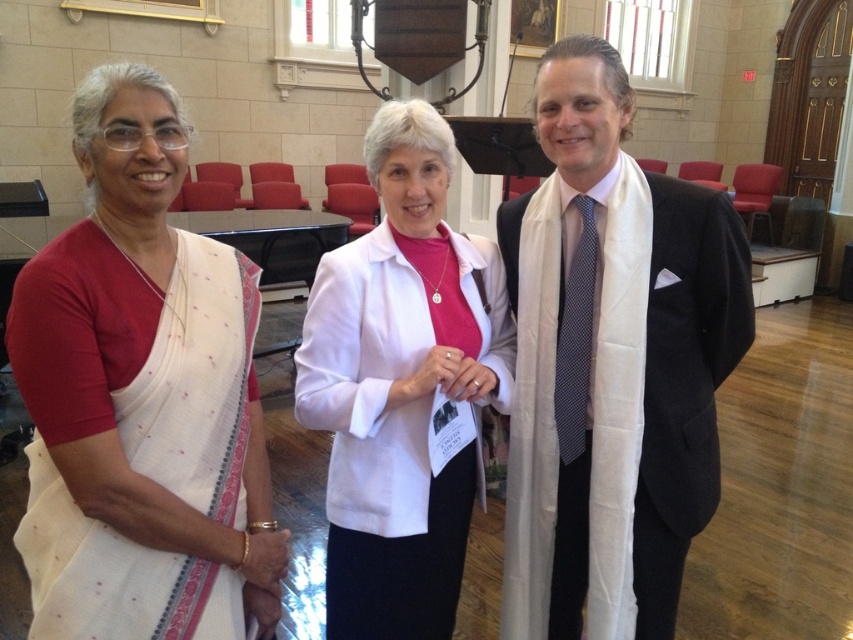
Is white matte jacket at center in front of dark blue dotted tie at center?

Yes, white matte jacket at center is closer to the viewer.

In order to click on white matte jacket at center in this screenshot , I will do `click(401, 387)`.

Where is `white matte jacket at center`? The image size is (853, 640). white matte jacket at center is located at coordinates (401, 387).

Between white textured saree at left and white matte jacket at center, which one is positioned lower?

white matte jacket at center is lower down.

Does white textured saree at left appear on the left side of white matte jacket at center?

Indeed, white textured saree at left is positioned on the left side of white matte jacket at center.

Is point (120, 428) positioned in front of point (320, 288)?

Yes, it is.

The image size is (853, 640). I want to click on white textured saree at left, so coord(143,378).

What do you see at coordinates (143, 378) in the screenshot?
I see `white textured saree at left` at bounding box center [143, 378].

Is point (248, 556) positioned in front of point (579, 234)?

Yes, it is.

I want to click on white textured saree at left, so pos(143,378).